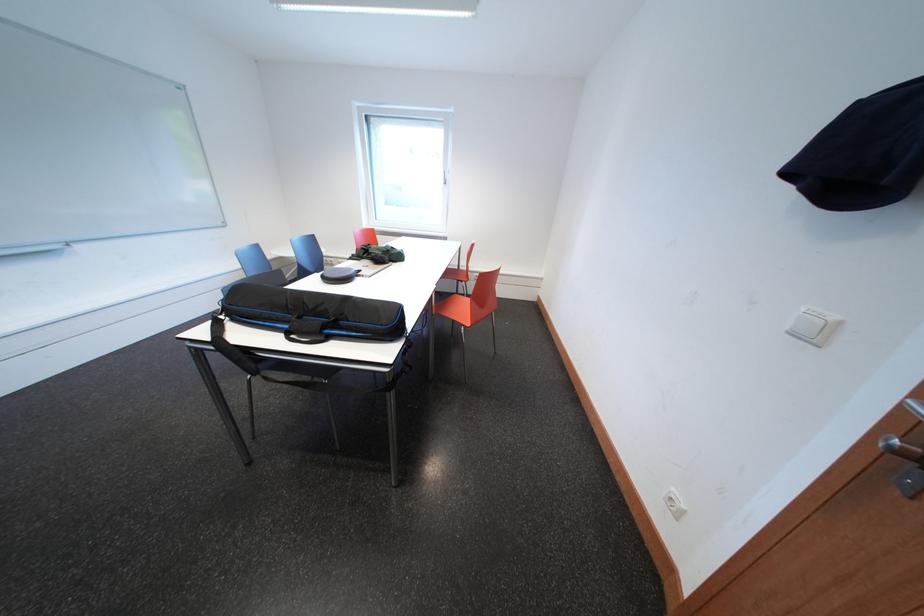
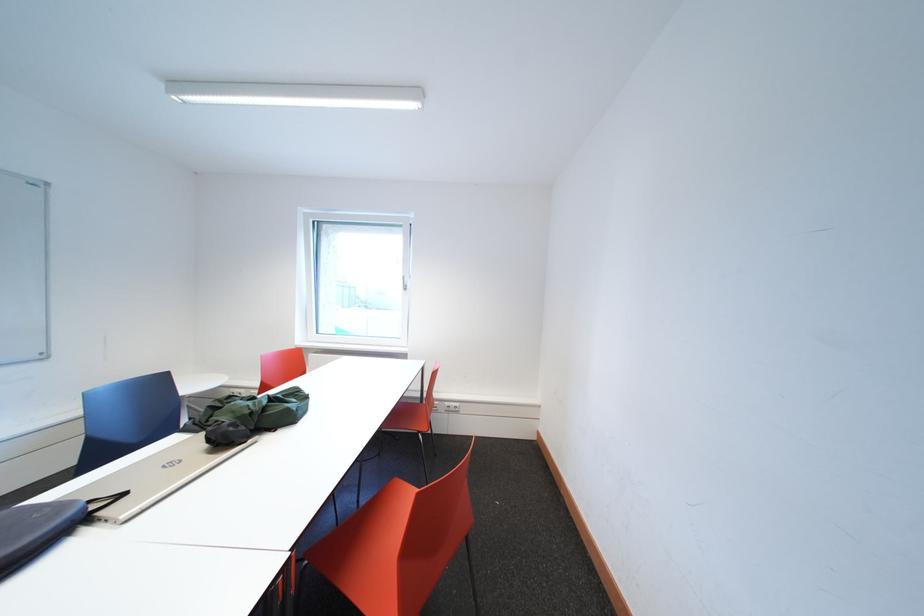
The point at (370,275) is marked in the first image. Where is the corresponding point in the second image?

(134, 499)